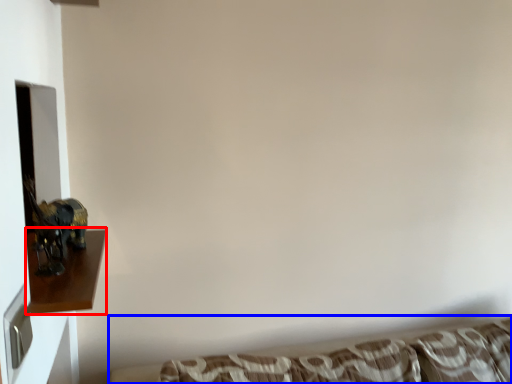
Question: Which point is closer to the camera, furniture (highlighted by a red box) or studio couch (highlighted by a blue box)?

Choices:
 (A) furniture
 (B) studio couch

Answer: (A)